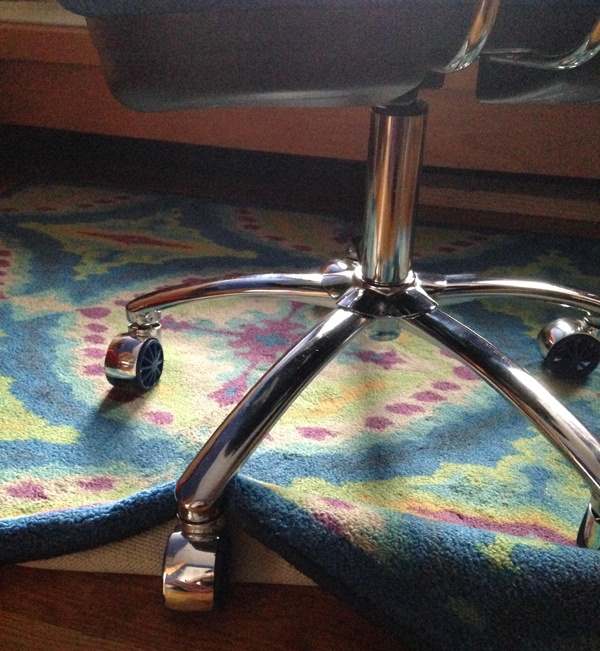
Locate an element on the screen. The width and height of the screenshot is (600, 651). designs on rug is located at coordinates (266, 342), (31, 490), (301, 230).